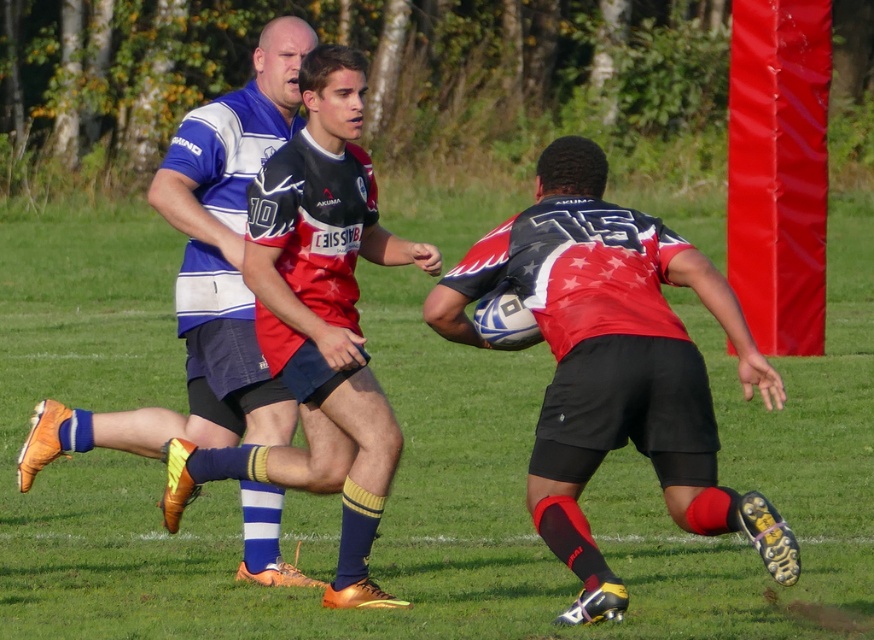
Question: Which point is farther to the camera?

Choices:
 (A) matte red rugby ball at center
 (B) green grass football field at center
 (C) blue/white striped jersey at upper left

Answer: (C)

Question: Does matte red rugby ball at center appear over blue/white striped jersey at upper left?

Choices:
 (A) yes
 (B) no

Answer: (B)

Question: Estimate the real-world distances between objects in this image. Which object is farther from the matte red rugby ball at center?

Choices:
 (A) green grass football field at center
 (B) blue/white striped jersey at upper left

Answer: (A)

Question: Is green grass football field at center wider than matte red rugby ball at center?

Choices:
 (A) no
 (B) yes

Answer: (B)

Question: Which object is the farthest from the blue/white striped jersey at upper left?

Choices:
 (A) green grass football field at center
 (B) matte red rugby ball at center

Answer: (A)

Question: Does green grass football field at center have a lesser width compared to matte red rugby ball at center?

Choices:
 (A) no
 (B) yes

Answer: (A)